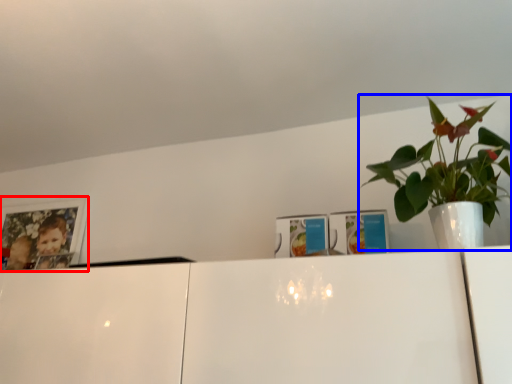
Question: Which point is closer to the camera, picture frame (highlighted by a red box) or houseplant (highlighted by a blue box)?

Choices:
 (A) picture frame
 (B) houseplant

Answer: (B)